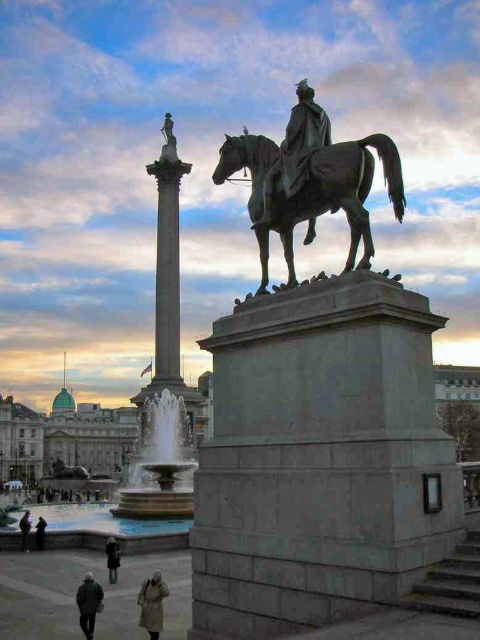
Question: Is bronze statue at center to the right of dark gray jacket at lower left from the viewer's perspective?

Choices:
 (A) no
 (B) yes

Answer: (B)

Question: Can you confirm if dark gray coat at lower left is smaller than dark brown leather coat at lower left?

Choices:
 (A) no
 (B) yes

Answer: (A)

Question: Is dark gray jacket at lower left closer to camera compared to dark brown leather coat at lower left?

Choices:
 (A) no
 (B) yes

Answer: (B)

Question: Which point is closer to the camera?

Choices:
 (A) dark gray coat at lower left
 (B) green stone pedestal at center
 (C) dark gray jacket at lower left
 (D) bronze statue at center

Answer: (B)

Question: Which object is the closest to the bronze statue at center?

Choices:
 (A) dark gray jacket at lower left
 (B) dark gray coat at lower center

Answer: (A)

Question: Estimate the real-world distances between objects in this image. Which object is farther from the dark gray coat at lower center?

Choices:
 (A) dark gray coat at lower left
 (B) dark brown leather coat at lower left
 (C) green stone pedestal at center
 (D) khaki wool coat at lower center

Answer: (C)